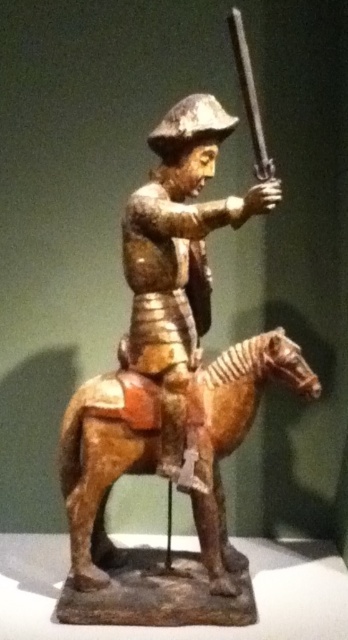
Question: Which point appears farthest from the camera in this image?

Choices:
 (A) (208, 131)
 (B) (255, 138)

Answer: (A)

Question: Can you confirm if wooden horse at center is smaller than polished metal rifle at upper center?

Choices:
 (A) no
 (B) yes

Answer: (A)

Question: Does wooden horse at center lie in front of wooden figure at center?

Choices:
 (A) no
 (B) yes

Answer: (A)

Question: Does wooden horse at center have a lesser width compared to polished metal rifle at upper center?

Choices:
 (A) no
 (B) yes

Answer: (A)

Question: Which of these objects is positioned farthest from the wooden horse at center?

Choices:
 (A) polished metal rifle at upper center
 (B) wooden figure at center

Answer: (A)

Question: Which point is farther to the camera?

Choices:
 (A) polished metal rifle at upper center
 (B) wooden horse at center

Answer: (B)